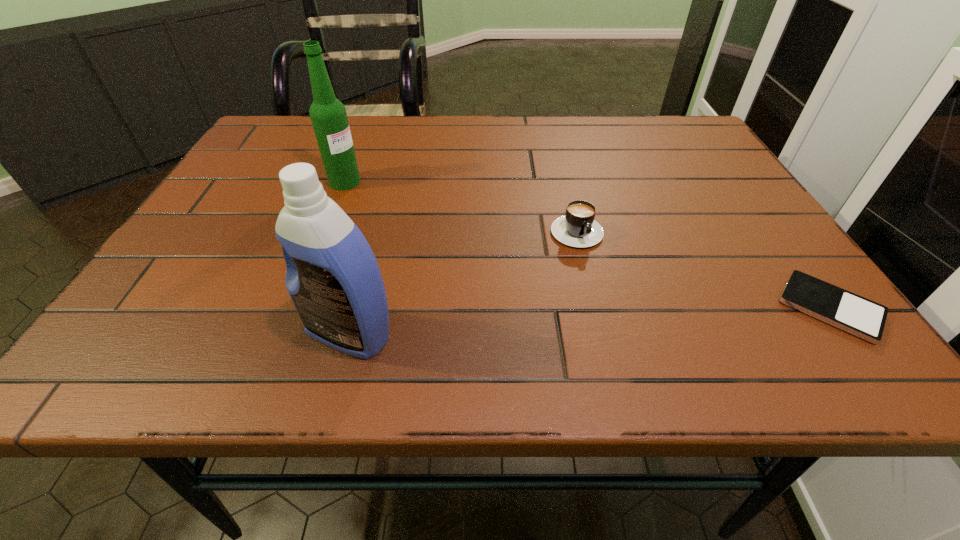
Image resolution: width=960 pixels, height=540 pixels. Identify the location of detergent. (333, 279).

I want to click on iPod, so click(x=856, y=315).

In order to click on the rightmost object in this screenshot , I will do `click(856, 315)`.

Image resolution: width=960 pixels, height=540 pixels. Find the location of `cappuccino`. cappuccino is located at coordinates (577, 228).

Where is `the third tallest object`? The height and width of the screenshot is (540, 960). the third tallest object is located at coordinates (577, 228).

Where is `the farthest object`? the farthest object is located at coordinates (328, 115).

Where is `blank space located on the back of the detergent`? This screenshot has height=540, width=960. blank space located on the back of the detergent is located at coordinates (372, 245).

Find the location of a particular element. The image size is (960, 540). free space located on the back of the shortest object is located at coordinates (736, 181).

Locate an element on the screen. This screenshot has width=960, height=540. vacant space located 0.090m with the handle on the side of the third nearest object is located at coordinates (604, 282).

Where is `vacant area situated on the label of the farthest object`? Image resolution: width=960 pixels, height=540 pixels. vacant area situated on the label of the farthest object is located at coordinates (444, 224).